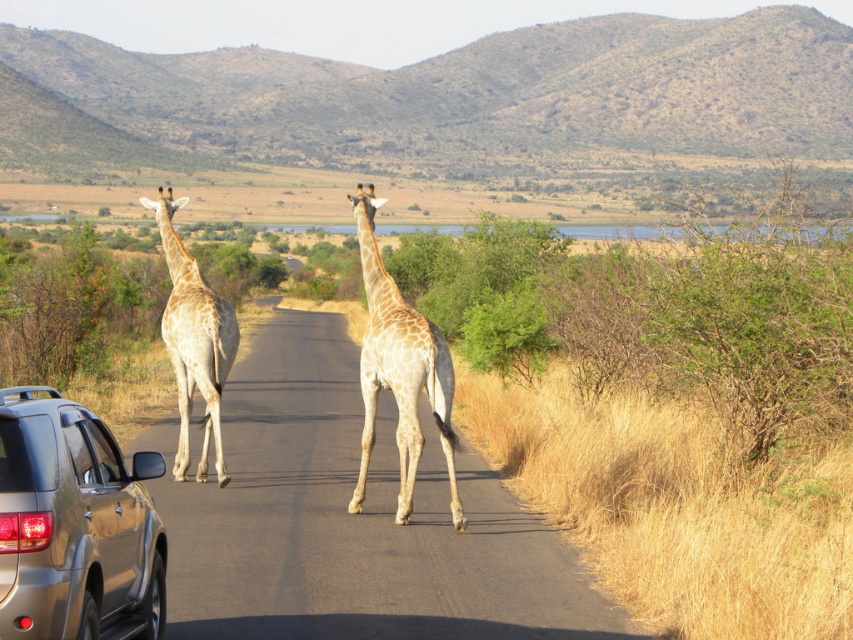
You are a photographer trying to capture a clear shot of the light brown textured giraffe at center. However, the satin silver car at lower left is blocking your view. Can you estimate whether the car is small enough to fit entirely within your camera frame while still keeping the giraffe in focus?

The satin silver car at lower left occupies less space than light brown textured giraffe at center. Since the car is smaller in size compared to the giraffe, it should be possible to position the camera so that the car fits within the frame while keeping the light brown textured giraffe at center in focus.

You are a wildlife photographer positioned at the center of the road. You want to take a photo of the light brown textured giraffe at center without the satin silver car at lower left blocking the view. Is the car currently in front of or behind the giraffe?

The satin silver car at lower left is in front of the light brown textured giraffe at center, so it is blocking the view of the giraffe.